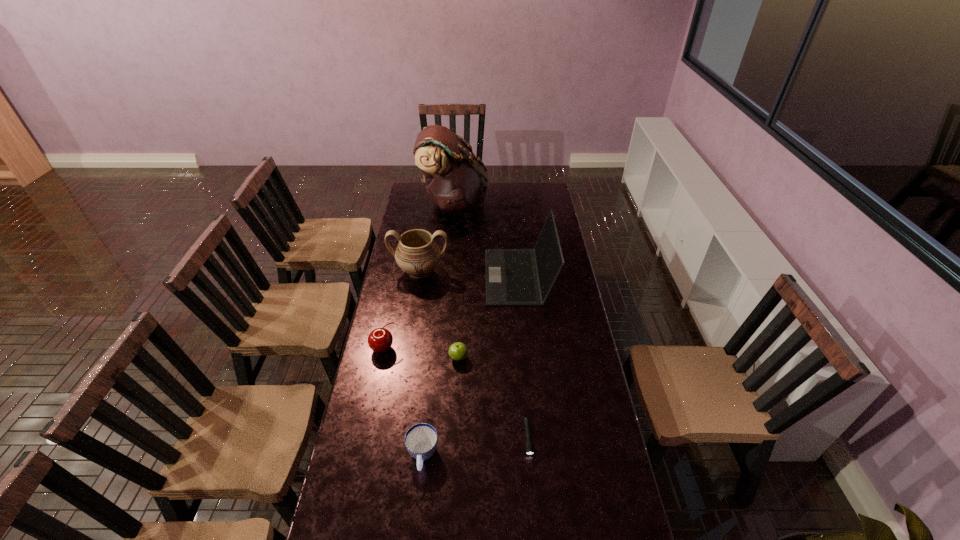
At what (x,y) coordinates should I click in order to perform the action: click on cherry at the left edge. Please return your answer as a coordinate pair (x, y). Image resolution: width=960 pixels, height=540 pixels. Looking at the image, I should click on (380, 340).

Identify the location of object that is positioned at the right edge. The width and height of the screenshot is (960, 540). (513, 276).

I want to click on object that is at the far left corner, so click(456, 180).

This screenshot has width=960, height=540. Find the location of `free space at the far edge`. free space at the far edge is located at coordinates (499, 191).

You are a GUI agent. You are given a task and a screenshot of the screen. Output one action in this format:
    pyautogui.click(x=<x>, y=<y>)
    Task: Click on the vacant space at the left edge of the desktop
    The height and width of the screenshot is (540, 960).
    Given the screenshot: What is the action you would take?
    pyautogui.click(x=413, y=329)

The image size is (960, 540). Identify the location of vacant position at the right edge of the desktop. (574, 360).

In the image, there is a desktop. What are the coordinates of `vacant space at the far right corner` in the screenshot? It's located at (536, 192).

At what (x,y) coordinates should I click in order to perform the action: click on free area in between the flashlight and the cherry. Please return your answer as a coordinate pair (x, y). Looking at the image, I should click on (456, 394).

Where is `vacant region between the apple and the tallest object`? vacant region between the apple and the tallest object is located at coordinates (456, 280).

Where is `free spot between the cup and the apple`? This screenshot has height=540, width=960. free spot between the cup and the apple is located at coordinates (441, 407).